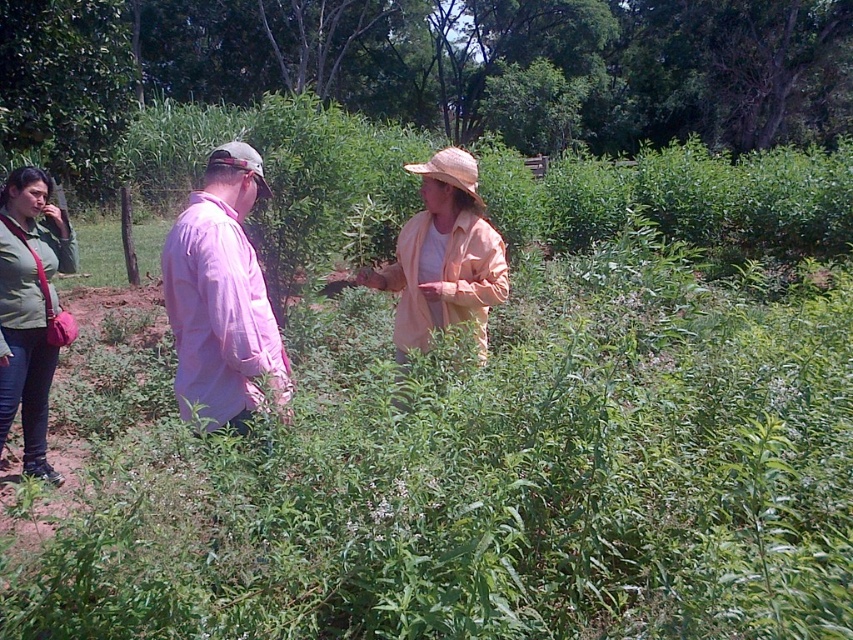
Question: Is matte green jacket at lower left positioned before straw at center?

Choices:
 (A) no
 (B) yes

Answer: (A)

Question: Does matte green jacket at lower left appear on the right side of straw at center?

Choices:
 (A) no
 (B) yes

Answer: (B)

Question: Which of the following is the closest to the observer?

Choices:
 (A) strawmaterial/texturehat at center
 (B) light peach fabric hat at center
 (C) straw at center
 (D) matte green jacket at lower left

Answer: (C)

Question: Is light peach fabric hat at center positioned before matte green jacket at lower left?

Choices:
 (A) no
 (B) yes

Answer: (B)

Question: Which object is closer to the camera taking this photo?

Choices:
 (A) matte green jacket at lower left
 (B) light peach fabric hat at center
 (C) strawmaterial/texturehat at center
 (D) pink cotton shirt at center

Answer: (D)

Question: Based on their relative distances, which object is nearer to the pink cotton shirt at center?

Choices:
 (A) strawmaterial/texturehat at center
 (B) straw at center

Answer: (B)